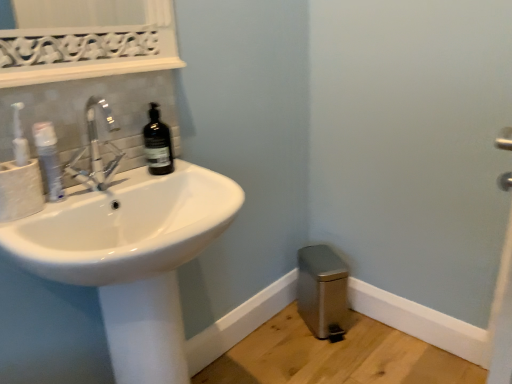
Question: Can you confirm if white glossy mouthwash at left is shorter than white glossy sink at left?

Choices:
 (A) no
 (B) yes

Answer: (B)

Question: From a real-world perspective, is white glossy mouthwash at left physically below white glossy sink at left?

Choices:
 (A) yes
 (B) no

Answer: (B)

Question: Does white glossy mouthwash at left have a greater height compared to white glossy sink at left?

Choices:
 (A) yes
 (B) no

Answer: (B)

Question: From the image's perspective, is white glossy mouthwash at left on white glossy sink at left?

Choices:
 (A) yes
 (B) no

Answer: (A)

Question: Can you confirm if white glossy mouthwash at left is thinner than white glossy sink at left?

Choices:
 (A) yes
 (B) no

Answer: (A)

Question: Is white glossy mouthwash at left not close to white glossy sink at left?

Choices:
 (A) yes
 (B) no

Answer: (B)

Question: Could you tell me if white glossy sink at left is turned towards satin silver trash can at lower right?

Choices:
 (A) no
 (B) yes

Answer: (A)

Question: Does white glossy sink at left appear on the right side of satin silver trash can at lower right?

Choices:
 (A) yes
 (B) no

Answer: (B)

Question: From a real-world perspective, is white glossy sink at left on satin silver trash can at lower right?

Choices:
 (A) yes
 (B) no

Answer: (A)

Question: From the image's perspective, would you say white glossy sink at left is shown under satin silver trash can at lower right?

Choices:
 (A) no
 (B) yes

Answer: (A)

Question: Does white glossy sink at left have a lesser height compared to satin silver trash can at lower right?

Choices:
 (A) yes
 (B) no

Answer: (B)

Question: Can we say white glossy sink at left lies outside satin silver trash can at lower right?

Choices:
 (A) no
 (B) yes

Answer: (B)

Question: Does matte white toilet paper at left turn towards white glossy mouthwash at left?

Choices:
 (A) no
 (B) yes

Answer: (A)